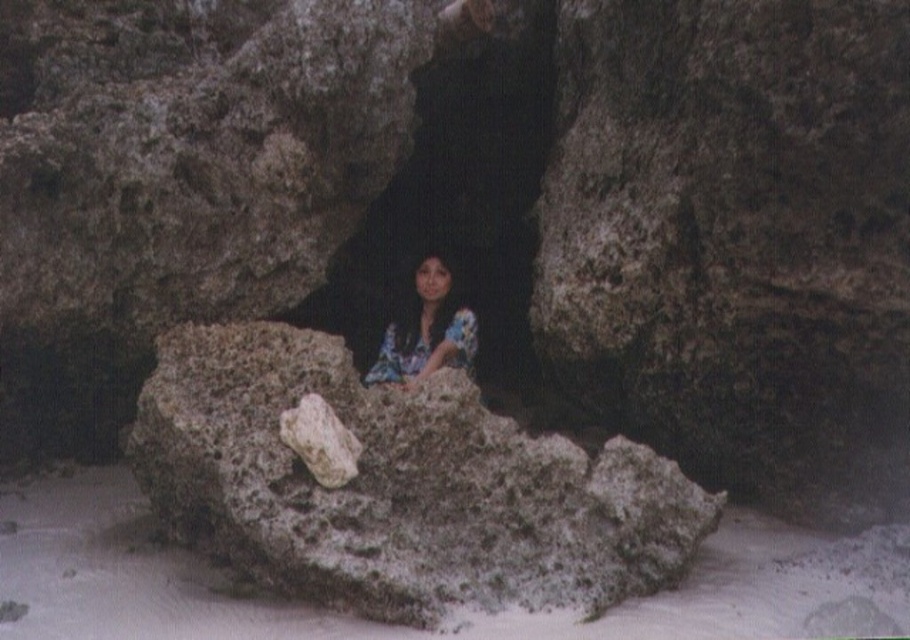
Question: Is rough textured rock at center above white sand at center?

Choices:
 (A) no
 (B) yes

Answer: (B)

Question: Does rough textured rock at center lie in front of floral fabric woman at center?

Choices:
 (A) yes
 (B) no

Answer: (A)

Question: Can you confirm if white sand at center is bigger than floral fabric woman at center?

Choices:
 (A) no
 (B) yes

Answer: (B)

Question: Estimate the real-world distances between objects in this image. Which object is closer to the floral fabric woman at center?

Choices:
 (A) rough textured rock at center
 (B) white sand at center

Answer: (A)

Question: Which object is closer to the camera taking this photo?

Choices:
 (A) floral fabric woman at center
 (B) white sand at center
 (C) rough textured rock at center

Answer: (B)

Question: Which point is closer to the camera taking this photo?

Choices:
 (A) (446, 307)
 (B) (595, 582)

Answer: (B)